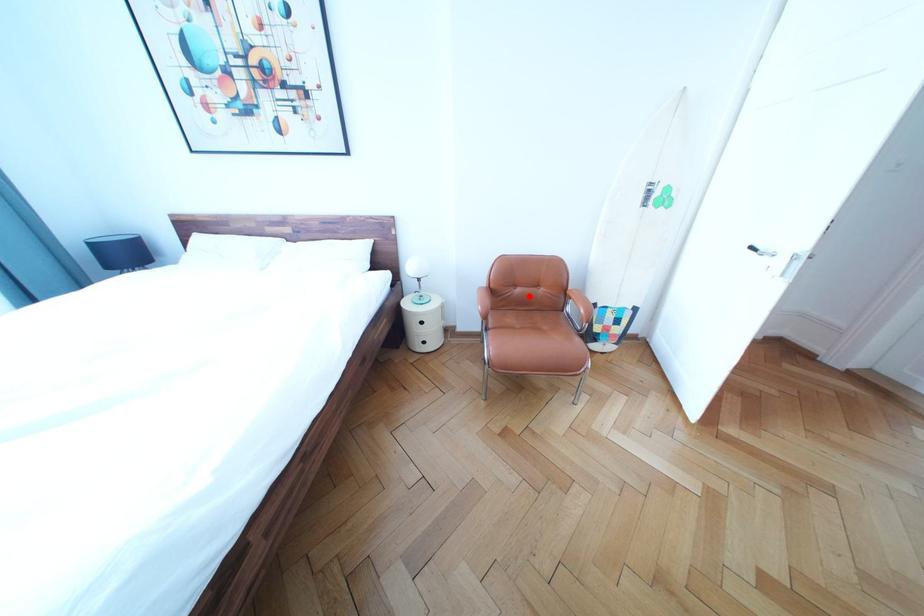
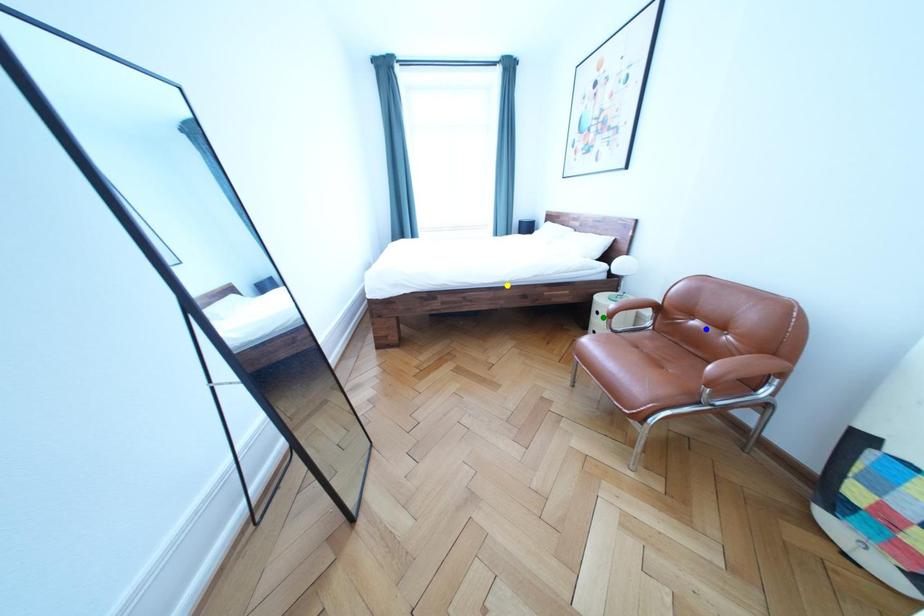
Question: I am providing you with two images of the same scene from different viewpoints. A red point is marked on the first image. You are given multiple points on the second image. Which spot in image 2 lines up with the point in image 1?

Choices:
 (A) yellow point
 (B) blue point
 (C) green point

Answer: (B)